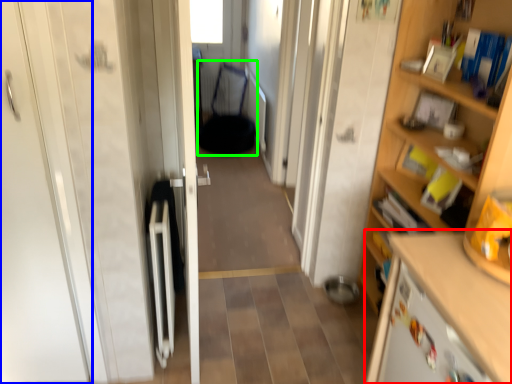
Question: Which object is positioned farthest from cabinetry (highlighted by a red box)? Select from door (highlighted by a blue box) and armchair (highlighted by a green box).

Choices:
 (A) door
 (B) armchair

Answer: (B)